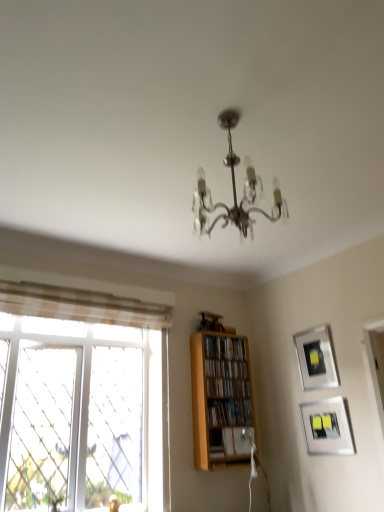
Question: Which direction should I rotate to look at wooden bookshelf at center, acting as the 4th book starting from the top?

Choices:
 (A) right
 (B) left

Answer: (A)

Question: Is wooden bookshelf at center, the 4th book from the bottom, shorter than wooden bookshelf at center, acting as the fifth book starting from the bottom?

Choices:
 (A) yes
 (B) no

Answer: (A)

Question: From the image's perspective, does wooden bookshelf at center, the 4th book from the bottom, appear lower than wooden bookshelf at center, acting as the fifth book starting from the bottom?

Choices:
 (A) yes
 (B) no

Answer: (A)

Question: Does wooden bookshelf at center, the 4th book from the bottom, have a greater height compared to wooden bookshelf at center, marked as the 1th book in a top-to-bottom arrangement?

Choices:
 (A) yes
 (B) no

Answer: (B)

Question: Considering the relative sizes of wooden bookshelf at center, the 4th book from the bottom, and wooden bookshelf at center, acting as the fifth book starting from the bottom, in the image provided, is wooden bookshelf at center, the 4th book from the bottom, wider than wooden bookshelf at center, acting as the fifth book starting from the bottom,?

Choices:
 (A) no
 (B) yes

Answer: (A)

Question: Is wooden bookshelf at center, the 4th book from the bottom, oriented away from wooden bookshelf at center, acting as the fifth book starting from the bottom?

Choices:
 (A) yes
 (B) no

Answer: (B)

Question: Are wooden bookshelf at center, the second book viewed from the top, and wooden bookshelf at center, marked as the 1th book in a top-to-bottom arrangement, located far from each other?

Choices:
 (A) no
 (B) yes

Answer: (A)

Question: Can you confirm if wooden bookshelf at center, acting as the fifth book starting from the bottom, is thinner than wooden shelf at center?

Choices:
 (A) yes
 (B) no

Answer: (B)

Question: Would you say wooden bookshelf at center, acting as the fifth book starting from the bottom, is outside wooden shelf at center?

Choices:
 (A) yes
 (B) no

Answer: (B)

Question: Is wooden bookshelf at center, acting as the fifth book starting from the bottom, shorter than wooden shelf at center?

Choices:
 (A) yes
 (B) no

Answer: (A)

Question: Considering the relative sizes of wooden bookshelf at center, marked as the 1th book in a top-to-bottom arrangement, and wooden shelf at center in the image provided, is wooden bookshelf at center, marked as the 1th book in a top-to-bottom arrangement, smaller than wooden shelf at center?

Choices:
 (A) yes
 (B) no

Answer: (A)

Question: Is wooden shelf at center surrounded by wooden bookshelf at center, acting as the fifth book starting from the bottom?

Choices:
 (A) no
 (B) yes

Answer: (A)

Question: Can you confirm if wooden bookshelf at center, marked as the 1th book in a top-to-bottom arrangement, is wider than wooden shelf at center?

Choices:
 (A) no
 (B) yes

Answer: (B)

Question: From the image's perspective, is wooden bookshelf at center, acting as the fifth book starting from the bottom, on top of wooden bookshelf at center, the 4th book from the bottom?

Choices:
 (A) no
 (B) yes

Answer: (B)